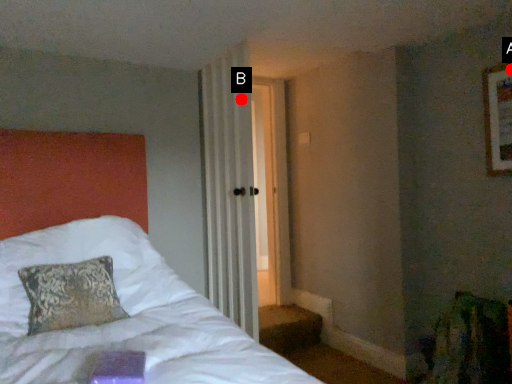
Question: Two points are circled on the image, labeled by A and B beside each circle. Among these points, which one is farthest from the camera?

Choices:
 (A) A is further
 (B) B is further

Answer: (B)